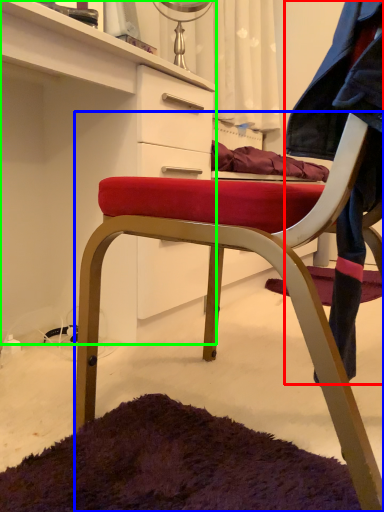
Question: Based on their relative distances, which object is nearer to denim jacket (highlighted by a red box)? Choose from chair (highlighted by a blue box) and cabinetry (highlighted by a green box).

Choices:
 (A) chair
 (B) cabinetry

Answer: (A)